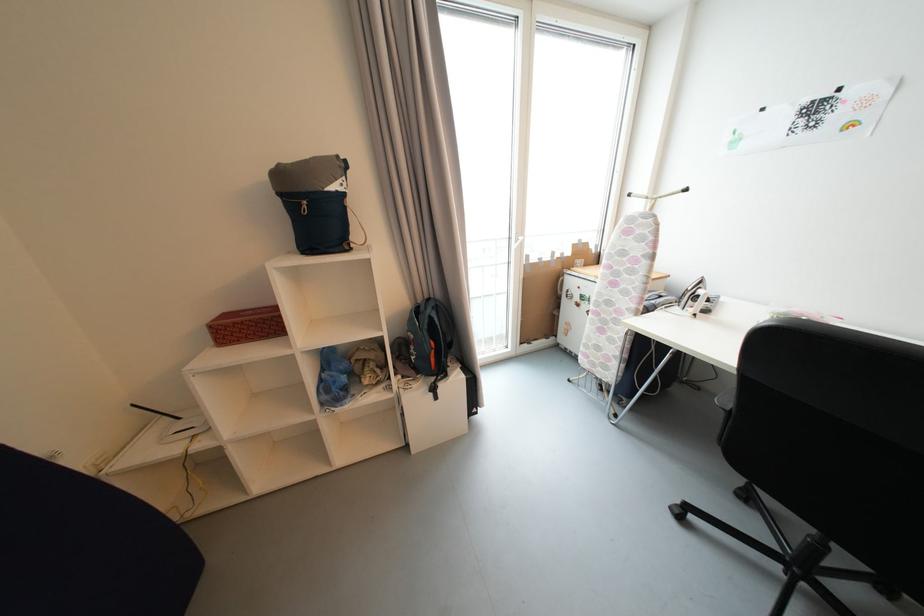
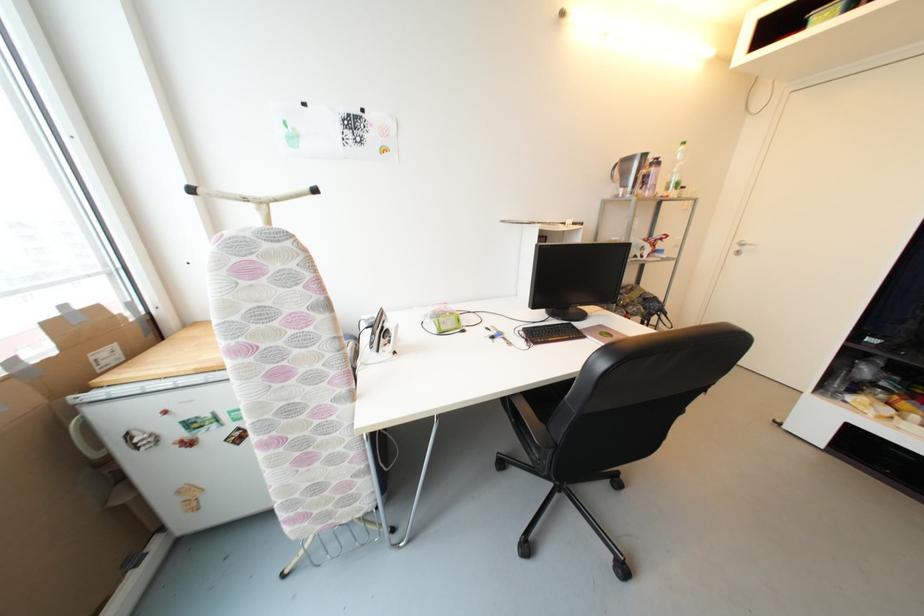
The images are taken continuously from a first-person perspective. In which direction is your viewpoint rotating?

The rotation direction of the camera is right-down.